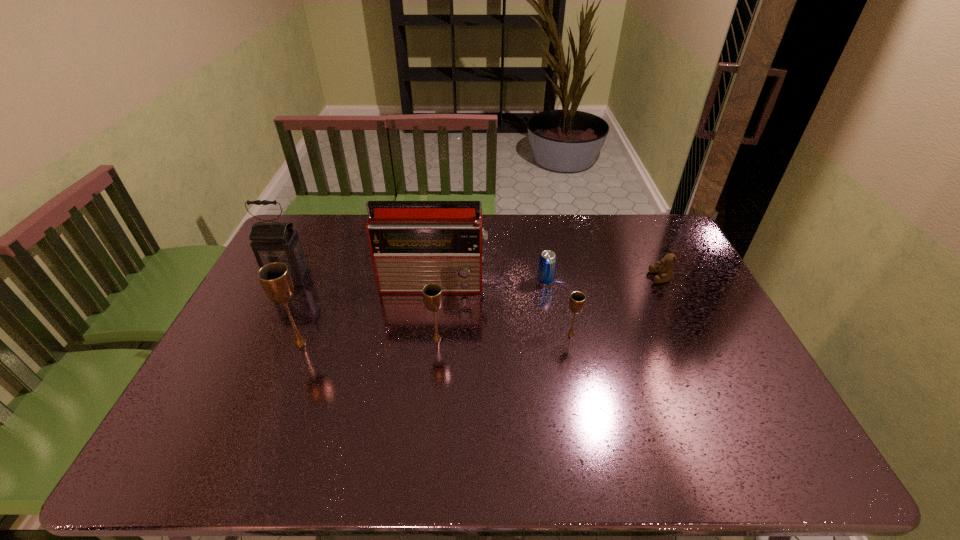
Find the location of a particular element. This screenshot has height=540, width=960. free space between the lantern and the fourth shortest object is located at coordinates (363, 308).

Find the location of `free space between the teddy bear and the leftmost chalice`. free space between the teddy bear and the leftmost chalice is located at coordinates (481, 310).

What are the coordinates of `blank region between the fourth tallest object and the beer can` in the screenshot? It's located at (491, 309).

Identify which object is the sixth closest to the beer can. Please provide its 2D coordinates. Your answer should be formatted as a tuple, i.e. [(x, y)], where the tuple contains the x and y coordinates of a point satisfying the conditions above.

[(271, 242)]

Identify the location of the fifth closest object to the lantern. This screenshot has height=540, width=960. (577, 299).

Choose which chalice is the nearest neighbor to the second tallest chalice. Please provide its 2D coordinates. Your answer should be formatted as a tuple, i.e. [(x, y)], where the tuple contains the x and y coordinates of a point satisfying the conditions above.

[(275, 278)]

Locate an element on the screen. This screenshot has height=540, width=960. chalice that stands as the second closest to the teddy bear is located at coordinates (432, 293).

The height and width of the screenshot is (540, 960). In order to click on free location that satisfies the following two spatial constraints: 1. on the front-facing side of the teddy bear; 2. on the front-facing side of the lantern in this screenshot , I will do click(x=661, y=278).

You are a GUI agent. You are given a task and a screenshot of the screen. Output one action in this format:
    pyautogui.click(x=<x>, y=<y>)
    Task: Click on the vacant space that satisfies the following two spatial constraints: 1. on the front-facing side of the rightmost object; 2. on the front-facing side of the radio receiver
    
    Given the screenshot: What is the action you would take?
    pyautogui.click(x=663, y=282)

This screenshot has height=540, width=960. What are the coordinates of `vacant space that satisfies the following two spatial constraints: 1. on the front-facing side of the lantern; 2. on the right side of the beer can` in the screenshot? It's located at (288, 281).